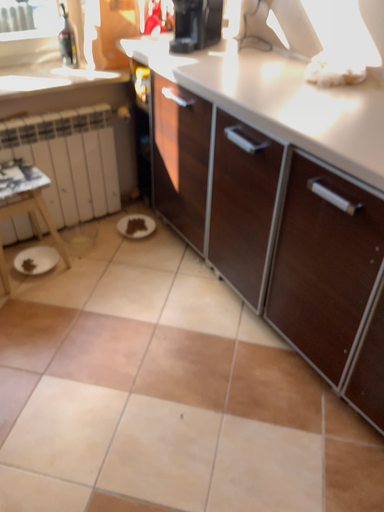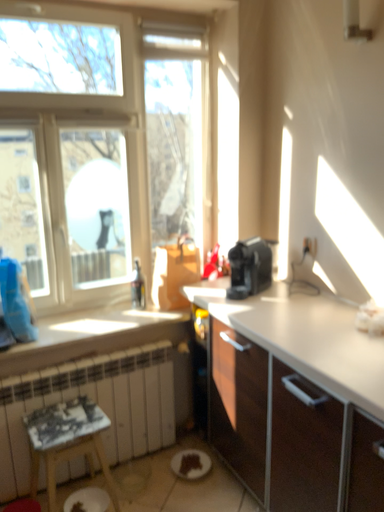
Question: Which way did the camera rotate in the video?

Choices:
 (A) rotated left
 (B) rotated right

Answer: (A)